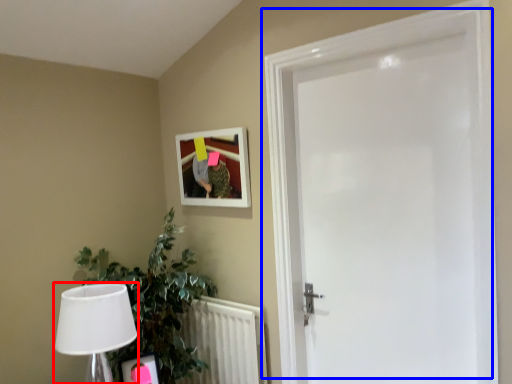
Question: Which point is further to the camera, table lamp (highlighted by a red box) or door (highlighted by a blue box)?

Choices:
 (A) table lamp
 (B) door

Answer: (A)